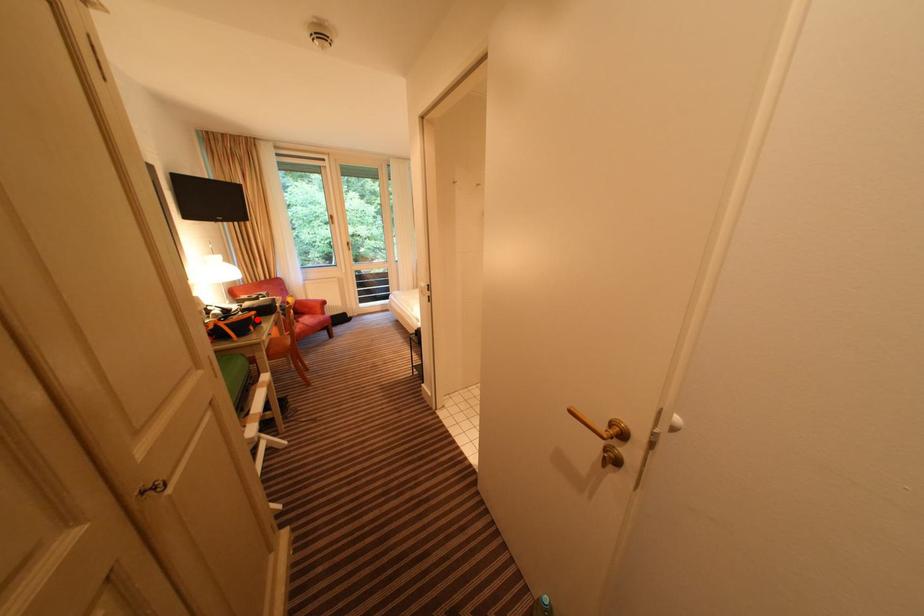
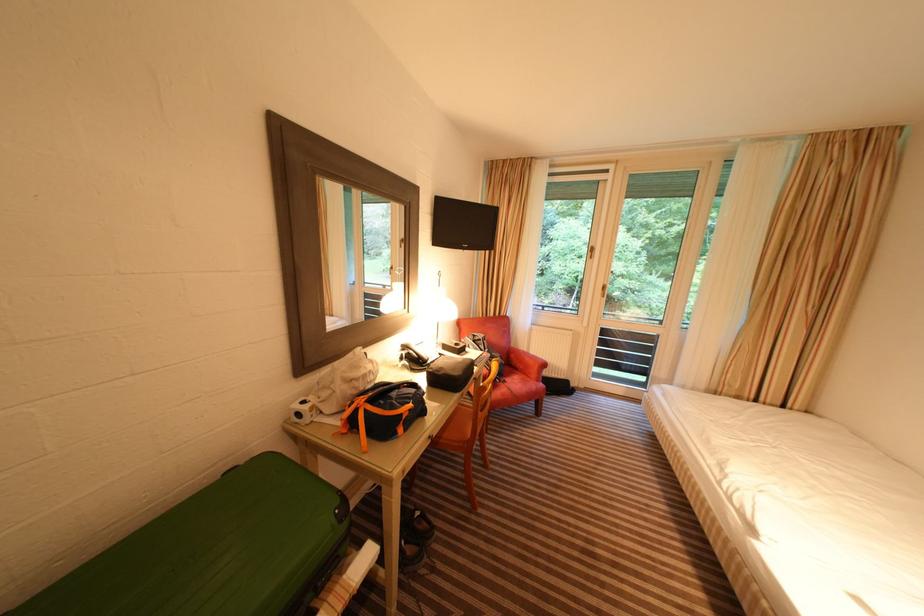
Question: I am providing you with two images of the same scene from different viewpoints. In image1, a red point is highlighted. Considering the same 3D point in image2, which of the following is correct?

Choices:
 (A) It is closer
 (B) It is farther

Answer: (B)